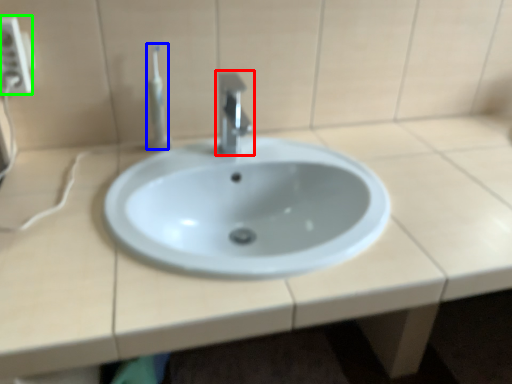
Question: Considering the real-world distances, which object is farthest from tap (highlighted by a red box)? toothbrush (highlighted by a blue box) or electric outlet (highlighted by a green box)?

Choices:
 (A) toothbrush
 (B) electric outlet

Answer: (B)